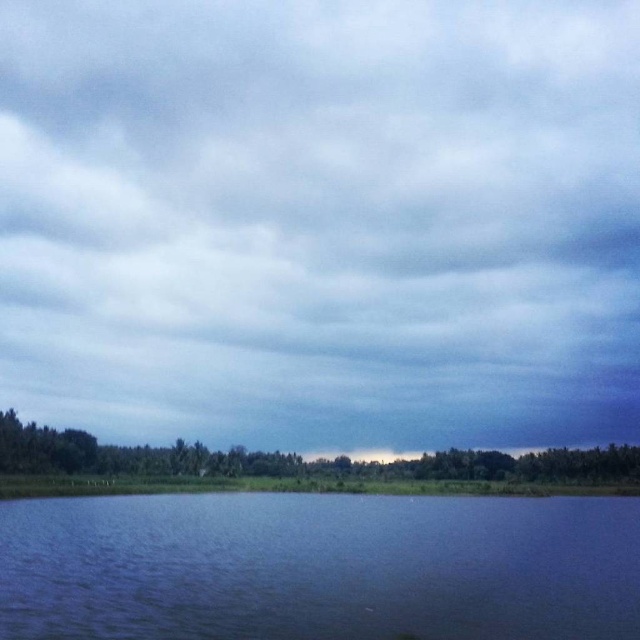
You are an observer looking at the scene. Which object is closer to you, the cloudy sky at upper center or the blue liquid water at bottom?

The cloudy sky at upper center is closer to you because it is in front of the blue liquid water at bottom.

You are standing at the edge of the landscape and want to reach the green leafy trees at lower left. Which direction should you move relative to the blue liquid water at bottom to get closer to the trees?

Since the blue liquid water at bottom is closer to the viewer than the green leafy trees at lower left, you should move away from the blue liquid water at bottom to reach the green leafy trees at lower left.

You are a drone operator trying to navigate between two points in the serene landscape. The first point is at coordinates point (65, 390) and the second point is at point (628, 483). According to the image, which point is closer to the drone operator?

Point (65, 390) is behind point (628, 483), so the closer point to the drone operator would be point (628, 483).